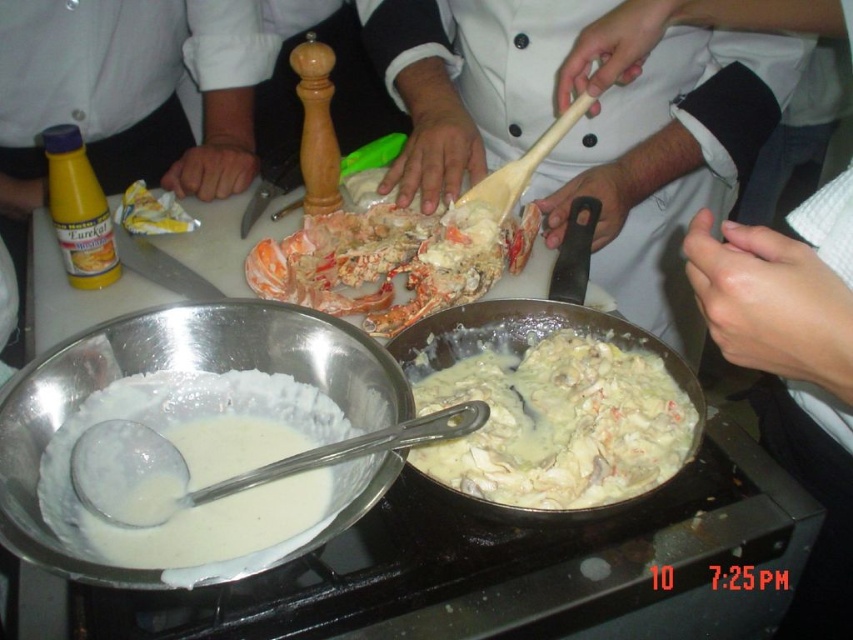
Question: Which object is closer to the camera taking this photo?

Choices:
 (A) white glossy lobster at center
 (B) white creamy sauce at center

Answer: (B)

Question: Does white glossy lobster at center have a larger size compared to white creamy liquid at center?

Choices:
 (A) yes
 (B) no

Answer: (A)

Question: Which object is positioned farthest from the white glossy lobster at center?

Choices:
 (A) white creamy liquid at center
 (B) orange shell lobster at center
 (C) white creamy sauce at center

Answer: (A)

Question: Where is white glossy lobster at center located in relation to white creamy sauce at center in the image?

Choices:
 (A) above
 (B) below

Answer: (A)

Question: Considering the relative positions of white glossy lobster at center and white creamy sauce at center in the image provided, where is white glossy lobster at center located with respect to white creamy sauce at center?

Choices:
 (A) below
 (B) above

Answer: (B)

Question: Which object is farther from the camera taking this photo?

Choices:
 (A) white creamy sauce at center
 (B) orange shell lobster at center
 (C) white glossy lobster at center

Answer: (C)